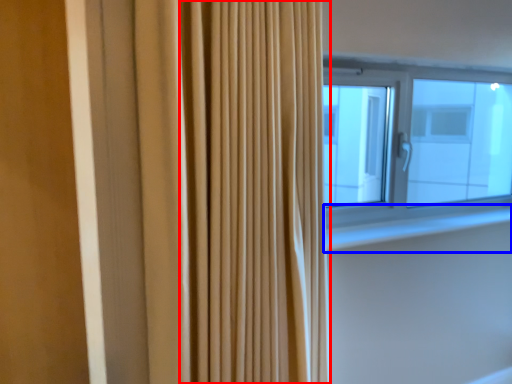
Question: Which point is further to the camera, shower curtain (highlighted by a red box) or window sill (highlighted by a blue box)?

Choices:
 (A) shower curtain
 (B) window sill

Answer: (B)